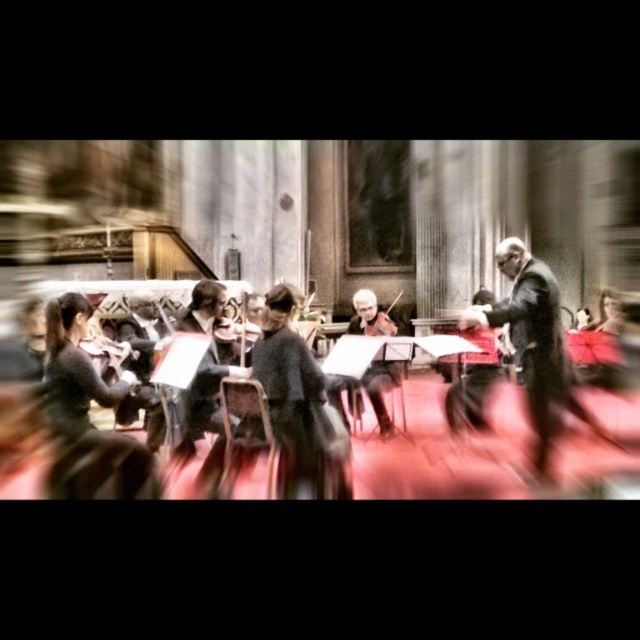
You are standing at the point labeled as point (x=529, y=406) in a classical music performance hall. The distance between you and the viewer is 63.56 meters. If you want to move closer to the viewer, which direction should you walk?

Since the point (x=529, y=406) is 63.56 meters away from the viewer, moving towards the viewer would require walking in the direction opposite to where the point is located. However, without additional spatial context about the hall layout, it is impossible to determine the exact direction to walk.

You are a photographer standing at the camera position. You want to capture a closeup shot of the black glossy violin at center. Given that the camera is 51.99 meters away from the violin, is this distance feasible for a clear closeup without moving closer?

The black glossy violin at center and camera are 51.99 meters apart. This distance is too far for a standard camera to capture a clear closeup without using specialized equipment like a telephoto lens. Moving closer would be advisable for a clearer shot.

Looking at this image, you are a photographer trying to capture a clear shot of both the black glossy violin at center and the shiny black violin at center during a performance. Since the scene is blurred due to motion, which violin should you adjust your camera focus to first to ensure it appears sharp in the final image?

The black glossy violin at center is to the right of shiny black violin at center. Since both violins are at the center, adjusting focus on the shiny black violin at center first would place it closer to the center of the frame, ensuring it appears sharp, then adjust to the right for the black glossy violin at center.